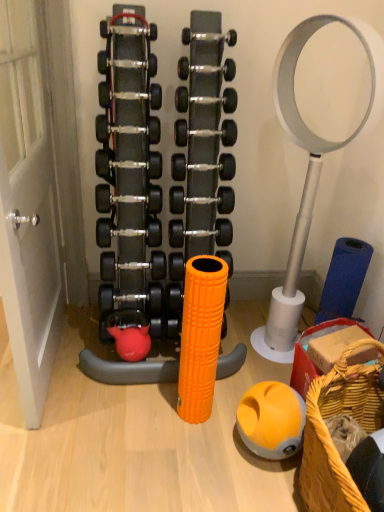
Identify the location of unoccupied area in front of orange textured foam roller at center. Image resolution: width=384 pixels, height=512 pixels. [198, 444].